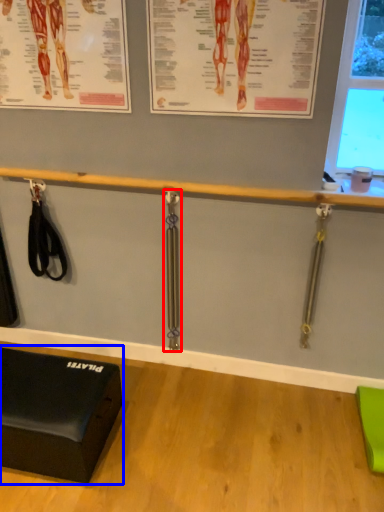
Question: Which of the following is the closest to the observer, weight (highlighted by a red box) or furniture (highlighted by a blue box)?

Choices:
 (A) weight
 (B) furniture

Answer: (B)